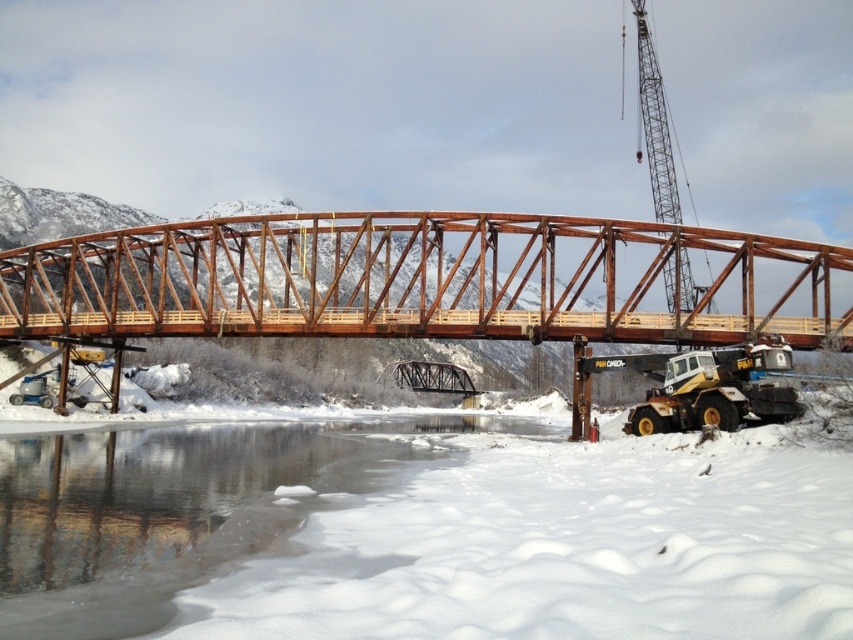
Does yellow rubber excavator at lower right appear under metallic gray crane at upper right?

Yes, yellow rubber excavator at lower right is below metallic gray crane at upper right.

How much distance is there between yellow rubber excavator at lower right and metallic gray crane at upper right?

They are 132.17 feet apart.

Is point (695, 384) closer to camera compared to point (668, 262)?

Yes, it is.

The height and width of the screenshot is (640, 853). What are the coordinates of `yellow rubber excavator at lower right` in the screenshot? It's located at (718, 388).

From the picture: Between brown metallic bridge at center and yellow rubber excavator at lower right, which one appears on the right side from the viewer's perspective?

Positioned to the right is yellow rubber excavator at lower right.

Does brown metallic bridge at center appear on the left side of yellow rubber excavator at lower right?

Yes, brown metallic bridge at center is to the left of yellow rubber excavator at lower right.

This screenshot has width=853, height=640. What do you see at coordinates (426, 280) in the screenshot? I see `brown metallic bridge at center` at bounding box center [426, 280].

Where is `brown metallic bridge at center`? Image resolution: width=853 pixels, height=640 pixels. brown metallic bridge at center is located at coordinates pos(426,280).

From the picture: Is brown metallic bridge at center smaller than metallic gray crane at upper right?

No.

Is brown metallic bridge at center shorter than metallic gray crane at upper right?

Indeed, brown metallic bridge at center has a lesser height compared to metallic gray crane at upper right.

Is point (468, 330) positioned behind point (653, 108)?

No.

Identify the location of brown metallic bridge at center. [426, 280].